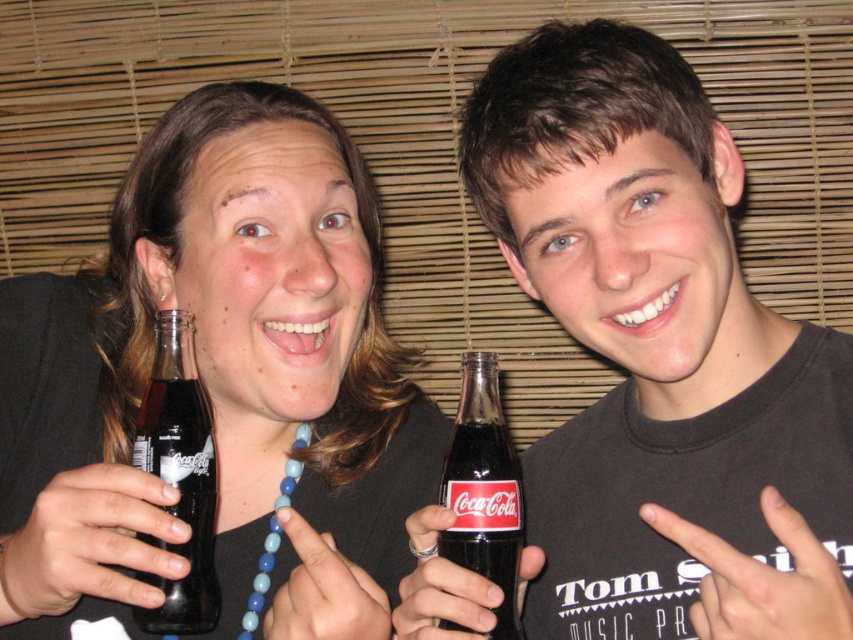
From the picture: You are standing in front of the image and want to place a sticker exactly at the position of the black glass bottle at right. What are the coordinates where you should place the sticker?

The coordinates for the black glass bottle at right are 0.559 on the x axis and 0.774 on the y axis.